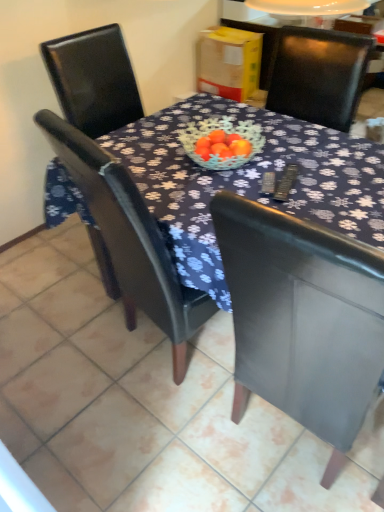
Where is `matte black chair at center, the 2th chair positioned from the left`? matte black chair at center, the 2th chair positioned from the left is located at coordinates (302, 319).

The image size is (384, 512). Describe the element at coordinates (302, 319) in the screenshot. I see `matte black chair at center, the first chair from the right` at that location.

What is the approximate width of matte black chair at center, marked as the 1th chair in a left-to-right arrangement?

It is 25.22 inches.

Describe the element at coordinates (130, 240) in the screenshot. I see `matte black chair at center, arranged as the 2th chair when viewed from the right` at that location.

What are the coordinates of `matte black chair at center, arranged as the 2th chair when viewed from the right` in the screenshot? It's located at (130, 240).

This screenshot has width=384, height=512. What are the coordinates of `matte black chair at center, the 2th chair positioned from the left` in the screenshot? It's located at (302, 319).

Which object is positioned more to the left, matte black chair at center, the first chair from the right, or matte black chair at center, arranged as the 2th chair when viewed from the right?

matte black chair at center, arranged as the 2th chair when viewed from the right, is more to the left.

Looking at this image, is matte black chair at center, the first chair from the right, in front of matte black chair at center, marked as the 1th chair in a left-to-right arrangement?

That is True.

Which point is more distant from viewer, (381,361) or (145,220)?

The point (145,220) is farther.

From the image's perspective, between matte black chair at center, the first chair from the right, and matte black chair at center, arranged as the 2th chair when viewed from the right, who is located below?

From the image's view, matte black chair at center, the first chair from the right, is below.

From a real-world perspective, who is located higher, matte black chair at center, the first chair from the right, or matte black chair at center, arranged as the 2th chair when viewed from the right?

matte black chair at center, arranged as the 2th chair when viewed from the right, from a real-world perspective.

Does matte black chair at center, the 2th chair positioned from the left, have a lesser width compared to matte black chair at center, arranged as the 2th chair when viewed from the right?

Correct, the width of matte black chair at center, the 2th chair positioned from the left, is less than that of matte black chair at center, arranged as the 2th chair when viewed from the right.

Which of these two, matte black chair at center, the first chair from the right, or matte black chair at center, marked as the 1th chair in a left-to-right arrangement, stands shorter?

matte black chair at center, marked as the 1th chair in a left-to-right arrangement.

Considering the sizes of objects matte black chair at center, the 2th chair positioned from the left, and matte black chair at center, marked as the 1th chair in a left-to-right arrangement, in the image provided, who is smaller, matte black chair at center, the 2th chair positioned from the left, or matte black chair at center, marked as the 1th chair in a left-to-right arrangement,?

matte black chair at center, the 2th chair positioned from the left, is smaller.

Would you say matte black chair at center, marked as the 1th chair in a left-to-right arrangement, is part of matte black chair at center, the 2th chair positioned from the left,'s contents?

No.

Is matte black chair at center, the 2th chair positioned from the left, directly adjacent to matte black chair at center, arranged as the 2th chair when viewed from the right?

They are not placed beside each other.

Is matte black chair at center, the first chair from the right, oriented towards matte black chair at center, marked as the 1th chair in a left-to-right arrangement?

No, matte black chair at center, the first chair from the right, is not aimed at matte black chair at center, marked as the 1th chair in a left-to-right arrangement.

How many degrees apart are the facing directions of matte black chair at center, the 2th chair positioned from the left, and matte black chair at center, marked as the 1th chair in a left-to-right arrangement?

matte black chair at center, the 2th chair positioned from the left, and matte black chair at center, marked as the 1th chair in a left-to-right arrangement, are facing 10.2 degrees away from each other.

Measure the distance between matte black chair at center, the first chair from the right, and matte black chair at center, arranged as the 2th chair when viewed from the right.

matte black chair at center, the first chair from the right, is 17.41 inches away from matte black chair at center, arranged as the 2th chair when viewed from the right.

Where is `chair lying below the matte black chair at center, marked as the 1th chair in a left-to-right arrangement (from the image's perspective)`? The width and height of the screenshot is (384, 512). chair lying below the matte black chair at center, marked as the 1th chair in a left-to-right arrangement (from the image's perspective) is located at coordinates 302,319.

Is matte black chair at center, arranged as the 2th chair when viewed from the right, to the left of matte black chair at center, the 2th chair positioned from the left, from the viewer's perspective?

Yes, matte black chair at center, arranged as the 2th chair when viewed from the right, is to the left of matte black chair at center, the 2th chair positioned from the left.

In the scene shown: Is matte black chair at center, marked as the 1th chair in a left-to-right arrangement, behind matte black chair at center, the 2th chair positioned from the left?

Yes, it is behind matte black chair at center, the 2th chair positioned from the left.

Considering the points (112, 157) and (369, 268), which point is behind, point (112, 157) or point (369, 268)?

Point (112, 157)

Based on the photo, from the image's perspective, relative to matte black chair at center, the 2th chair positioned from the left, is matte black chair at center, marked as the 1th chair in a left-to-right arrangement, above or below?

Clearly, from the image's perspective, matte black chair at center, marked as the 1th chair in a left-to-right arrangement, is above matte black chair at center, the 2th chair positioned from the left.

From a real-world perspective, does matte black chair at center, arranged as the 2th chair when viewed from the right, stand above matte black chair at center, the first chair from the right?

Yes, from a real-world perspective, matte black chair at center, arranged as the 2th chair when viewed from the right, is over matte black chair at center, the first chair from the right

Can you confirm if matte black chair at center, arranged as the 2th chair when viewed from the right, is wider than matte black chair at center, the 2th chair positioned from the left?

Indeed, matte black chair at center, arranged as the 2th chair when viewed from the right, has a greater width compared to matte black chair at center, the 2th chair positioned from the left.

Does matte black chair at center, arranged as the 2th chair when viewed from the right, have a greater height compared to matte black chair at center, the first chair from the right?

Incorrect, the height of matte black chair at center, arranged as the 2th chair when viewed from the right, is not larger of that of matte black chair at center, the first chair from the right.

Who is bigger, matte black chair at center, arranged as the 2th chair when viewed from the right, or matte black chair at center, the 2th chair positioned from the left?

With larger size is matte black chair at center, arranged as the 2th chair when viewed from the right.

Is matte black chair at center, marked as the 1th chair in a left-to-right arrangement, spatially inside matte black chair at center, the 2th chair positioned from the left, or outside of it?

matte black chair at center, marked as the 1th chair in a left-to-right arrangement, lies outside matte black chair at center, the 2th chair positioned from the left.

Is matte black chair at center, marked as the 1th chair in a left-to-right arrangement, with matte black chair at center, the first chair from the right?

matte black chair at center, marked as the 1th chair in a left-to-right arrangement, is not next to matte black chair at center, the first chair from the right, and they're not touching.

Is matte black chair at center, arranged as the 2th chair when viewed from the right, positioned with its back to matte black chair at center, the first chair from the right?

That's not correct — matte black chair at center, arranged as the 2th chair when viewed from the right, is not looking away from matte black chair at center, the first chair from the right.

Based on the photo, how different are the orientations of matte black chair at center, arranged as the 2th chair when viewed from the right, and matte black chair at center, the 2th chair positioned from the left, in degrees?

The angular difference between matte black chair at center, arranged as the 2th chair when viewed from the right, and matte black chair at center, the 2th chair positioned from the left, is 10.2 degrees.

Image resolution: width=384 pixels, height=512 pixels. Identify the location of chair below the matte black chair at center, arranged as the 2th chair when viewed from the right (from the image's perspective). (302, 319).

The width and height of the screenshot is (384, 512). I want to click on chair that appears on the right of matte black chair at center, marked as the 1th chair in a left-to-right arrangement, so click(302, 319).

This screenshot has height=512, width=384. Find the location of `chair above the matte black chair at center, the first chair from the right (from the image's perspective)`. chair above the matte black chair at center, the first chair from the right (from the image's perspective) is located at coordinates (130, 240).